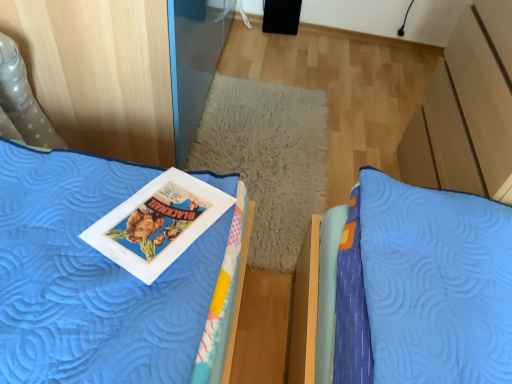
Locate an element on the screen. vacant location below blue quilted pillow at center (from a real-world perspective) is located at coordinates (270, 136).